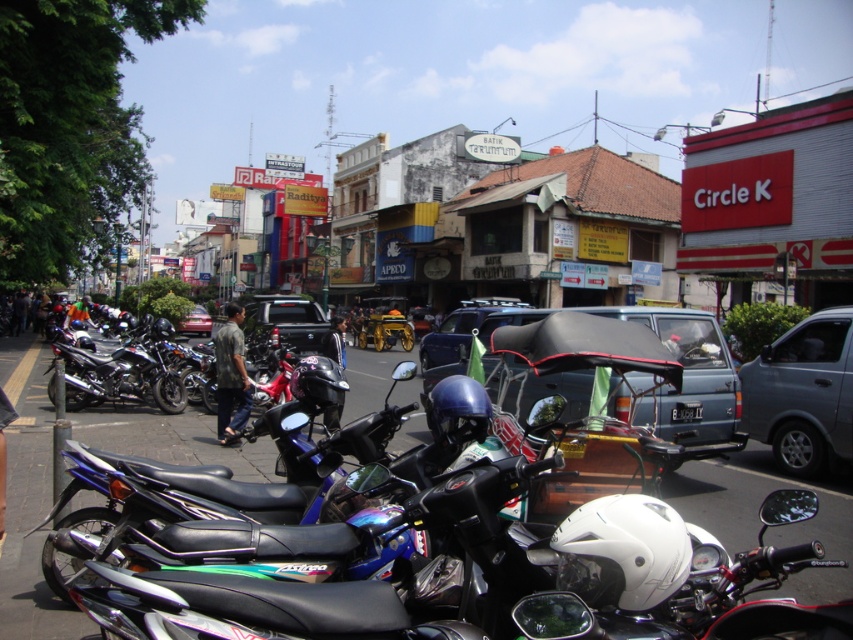
Between metallic blue pickup truck at center and dark blue jeans at center, which one is positioned lower?

dark blue jeans at center is below.

Who is positioned more to the right, metallic blue pickup truck at center or dark blue jeans at center?

Positioned to the right is dark blue jeans at center.

The image size is (853, 640). Identify the location of metallic blue pickup truck at center. (283, 323).

Where is `metallic blue pickup truck at center`? The image size is (853, 640). metallic blue pickup truck at center is located at coordinates (283, 323).

Is dark blue jeans at center positioned at the back of metallic red car at center?

That is False.

Does dark blue jeans at center come in front of metallic red car at center?

Yes.

This screenshot has width=853, height=640. What do you see at coordinates (334, 340) in the screenshot?
I see `dark blue jeans at center` at bounding box center [334, 340].

Where is `dark blue jeans at center`? dark blue jeans at center is located at coordinates (334, 340).

Can you confirm if metallic gray van at center-right is wider than metallic red car at center?

Incorrect, metallic gray van at center-right's width does not surpass metallic red car at center's.

Can you confirm if metallic gray van at center-right is positioned to the left of metallic red car at center?

Incorrect, metallic gray van at center-right is not on the left side of metallic red car at center.

Which is behind, point (773, 340) or point (199, 333)?

Point (199, 333)

Image resolution: width=853 pixels, height=640 pixels. In order to click on metallic gray van at center-right in this screenshot , I will do `click(804, 394)`.